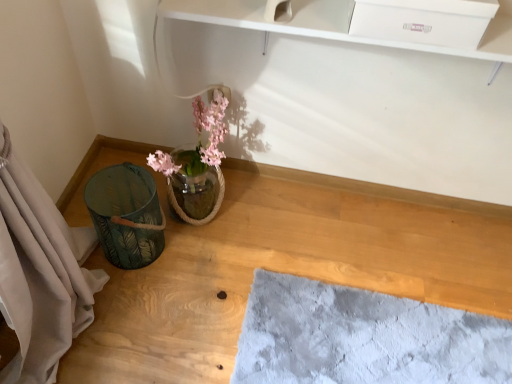
Question: Should I look upward or downward to see green fabric basket at lower left?

Choices:
 (A) up
 (B) down

Answer: (B)

Question: Can you confirm if green fabric basket at lower left is positioned to the right of white glossy drawer at upper center?

Choices:
 (A) no
 (B) yes

Answer: (A)

Question: Is green fabric basket at lower left oriented towards white glossy drawer at upper center?

Choices:
 (A) no
 (B) yes

Answer: (A)

Question: From the image's perspective, does green fabric basket at lower left appear higher than white glossy drawer at upper center?

Choices:
 (A) no
 (B) yes

Answer: (A)

Question: Considering the relative sizes of green fabric basket at lower left and white glossy drawer at upper center in the image provided, is green fabric basket at lower left wider than white glossy drawer at upper center?

Choices:
 (A) no
 (B) yes

Answer: (B)

Question: Is green fabric basket at lower left positioned before white glossy drawer at upper center?

Choices:
 (A) no
 (B) yes

Answer: (A)

Question: Is green fabric basket at lower left to the left of white glossy drawer at upper center from the viewer's perspective?

Choices:
 (A) no
 (B) yes

Answer: (B)

Question: Does green leaf-patterned basket at left come behind white glossy drawer at upper center?

Choices:
 (A) no
 (B) yes

Answer: (B)

Question: Does green leaf-patterned basket at left have a greater height compared to white glossy drawer at upper center?

Choices:
 (A) no
 (B) yes

Answer: (B)

Question: Considering the relative positions of green leaf-patterned basket at left and white glossy drawer at upper center in the image provided, is green leaf-patterned basket at left in front of white glossy drawer at upper center?

Choices:
 (A) yes
 (B) no

Answer: (B)

Question: Can you confirm if green leaf-patterned basket at left is smaller than white glossy drawer at upper center?

Choices:
 (A) yes
 (B) no

Answer: (B)

Question: Is green leaf-patterned basket at left outside white glossy drawer at upper center?

Choices:
 (A) no
 (B) yes

Answer: (B)

Question: Is green leaf-patterned basket at left oriented towards white glossy drawer at upper center?

Choices:
 (A) no
 (B) yes

Answer: (A)

Question: Considering the relative sizes of translucent glass vase at center and green fabric basket at lower left in the image provided, is translucent glass vase at center taller than green fabric basket at lower left?

Choices:
 (A) yes
 (B) no

Answer: (A)